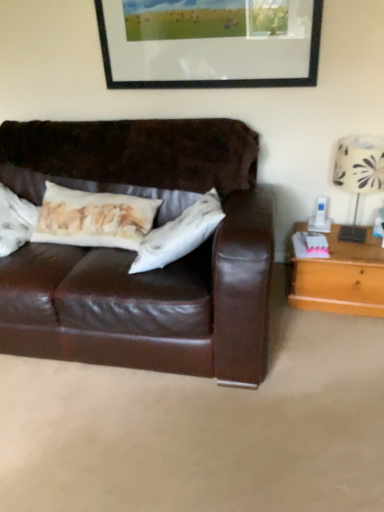
What is the approximate width of light brown wooden table at right?

14.85 inches.

You are a GUI agent. You are given a task and a screenshot of the screen. Output one action in this format:
    pyautogui.click(x=<x>, y=<y>)
    Task: Click on the light brown wooden table at right
    
    Given the screenshot: What is the action you would take?
    pyautogui.click(x=341, y=278)

Locate an element on the screen. light brown wooden table at right is located at coordinates click(341, 278).

Does black matte picture frame at upper center have a lesser height compared to white fabric lampshade at right?

Correct, black matte picture frame at upper center is not as tall as white fabric lampshade at right.

From a real-world perspective, between black matte picture frame at upper center and white fabric lampshade at right, who is vertically lower?

white fabric lampshade at right is physically lower.

Is black matte picture frame at upper center placed right next to white fabric lampshade at right?

black matte picture frame at upper center is not next to white fabric lampshade at right, and they're not touching.

Is light brown wooden table at right in front of black matte picture frame at upper center?

No, it is behind black matte picture frame at upper center.

Between light brown wooden table at right and black matte picture frame at upper center, which one appears on the right side from the viewer's perspective?

light brown wooden table at right is more to the right.

The image size is (384, 512). In the image, there is a light brown wooden table at right. What are the coordinates of `picture frame above it (from the image's perspective)` in the screenshot? It's located at (209, 44).

Is light brown wooden table at right next to white fabric lampshade at right and touching it?

No, light brown wooden table at right is not beside white fabric lampshade at right.

The height and width of the screenshot is (512, 384). I want to click on table behind the white fabric lampshade at right, so click(341, 278).

Is point (343, 262) more distant than point (346, 180)?

Yes.

From the image's perspective, is light brown wooden table at right located beneath white fabric lampshade at right?

Yes, from the image's perspective, light brown wooden table at right is below white fabric lampshade at right.

Can you tell me how much black matte picture frame at upper center and light brown wooden table at right differ in facing direction?

0.484 degrees.

Is black matte picture frame at upper center looking in the opposite direction of light brown wooden table at right?

No, black matte picture frame at upper center's orientation is not away from light brown wooden table at right.

From a real-world perspective, between black matte picture frame at upper center and light brown wooden table at right, who is vertically higher?

black matte picture frame at upper center, from a real-world perspective.

Does black matte picture frame at upper center contain light brown wooden table at right?

Definitely not — light brown wooden table at right is not inside black matte picture frame at upper center.

Between white fabric lampshade at right and black matte picture frame at upper center, which one has more height?

With more height is white fabric lampshade at right.

Which is farther, (359, 237) or (194, 55)?

Point (194, 55)

Does white fabric lampshade at right come behind black matte picture frame at upper center?

No.

Are white fabric lampshade at right and black matte picture frame at upper center making contact?

They are not placed beside each other.

From a real-world perspective, which object rests below the other?

From a 3D spatial view, light brown wooden table at right is below.

Is white fabric lampshade at right facing away from light brown wooden table at right?

That's not correct — white fabric lampshade at right is not looking away from light brown wooden table at right.

From the picture: Is white fabric lampshade at right located outside light brown wooden table at right?

Yes, white fabric lampshade at right is located beyond the bounds of light brown wooden table at right.

Is white fabric lampshade at right taller or shorter than light brown wooden table at right?

Considering their sizes, white fabric lampshade at right has more height than light brown wooden table at right.

This screenshot has height=512, width=384. Find the location of `picture frame positioned vertically above the white fabric lampshade at right (from a real-world perspective)`. picture frame positioned vertically above the white fabric lampshade at right (from a real-world perspective) is located at coordinates (209, 44).

At what (x,y) coordinates should I click in order to perform the action: click on picture frame lying above the light brown wooden table at right (from the image's perspective). Please return your answer as a coordinate pair (x, y). This screenshot has width=384, height=512. Looking at the image, I should click on (209, 44).

Looking at the image, which one is located further to light brown wooden table at right, black matte picture frame at upper center or white fabric lampshade at right?

black matte picture frame at upper center is further to light brown wooden table at right.

Looking at the image, which one is located further to black matte picture frame at upper center, white fabric lampshade at right or light brown wooden table at right?

light brown wooden table at right.

From the image, which object appears to be nearer to white fabric lampshade at right, black matte picture frame at upper center or light brown wooden table at right?

light brown wooden table at right lies closer to white fabric lampshade at right than the other object.

Which object lies nearer to the anchor point light brown wooden table at right, white fabric lampshade at right or black matte picture frame at upper center?

The object closer to light brown wooden table at right is white fabric lampshade at right.

Which object lies nearer to the anchor point black matte picture frame at upper center, light brown wooden table at right or white fabric lampshade at right?

Among the two, white fabric lampshade at right is located nearer to black matte picture frame at upper center.

Looking at the image, which one is located closer to white fabric lampshade at right, light brown wooden table at right or black matte picture frame at upper center?

light brown wooden table at right.

At what (x,y) coordinates should I click in order to perform the action: click on table lamp between black matte picture frame at upper center and light brown wooden table at right in the vertical direction. Please return your answer as a coordinate pair (x, y). The height and width of the screenshot is (512, 384). Looking at the image, I should click on (359, 174).